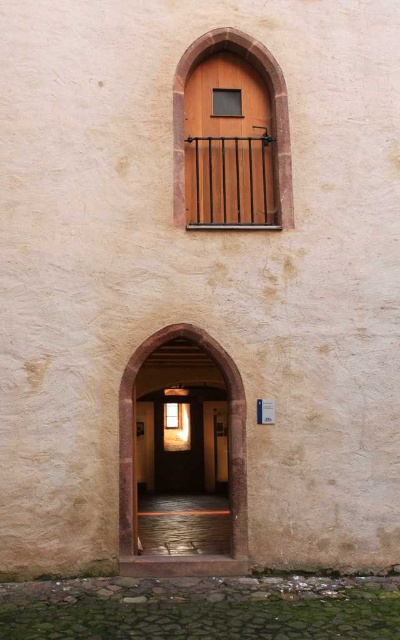
From the picture: Does wooden door at upper center have a lesser width compared to transparent glass window at upper center?

No.

Looking at this image, can you confirm if wooden door at upper center is bigger than transparent glass window at upper center?

Yes, wooden door at upper center is bigger than transparent glass window at upper center.

Does point (181, 220) lie behind point (174, 410)?

No, it is in front of (174, 410).

You are a GUI agent. You are given a task and a screenshot of the screen. Output one action in this format:
    pyautogui.click(x=<x>, y=<y>)
    Task: Click on the wooden door at upper center
    
    Given the screenshot: What is the action you would take?
    pyautogui.click(x=272, y=106)

Does smooth stone archway at center have a lesser width compared to wooden door at upper center?

Yes.

Which of these two, smooth stone archway at center or wooden door at upper center, stands taller?

smooth stone archway at center

Is point (131, 419) in front of point (245, 49)?

Yes, point (131, 419) is in front of point (245, 49).

At what (x,y) coordinates should I click in order to perform the action: click on smooth stone archway at center. Please return your answer as a coordinate pair (x, y). Looking at the image, I should click on (229, 440).

Which is behind, point (238, 481) or point (166, 419)?

The point (166, 419) is behind.

Who is shorter, smooth stone archway at center or transparent glass window at upper center?

With less height is transparent glass window at upper center.

Describe the element at coordinates (229, 440) in the screenshot. This screenshot has height=640, width=400. I see `smooth stone archway at center` at that location.

Find the location of a particular element. This screenshot has height=640, width=400. smooth stone archway at center is located at coordinates (229, 440).